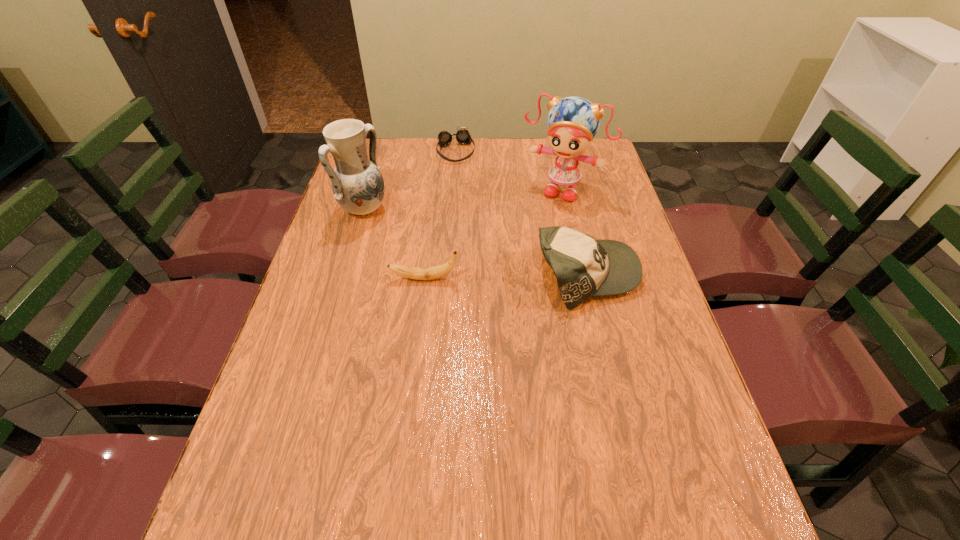
The width and height of the screenshot is (960, 540). What are the coordinates of `vacant space on the desktop that is between the second shortest object and the baseball cap and is positioned through the lenses of the farthest object` in the screenshot? It's located at (492, 277).

What are the coordinates of `free spot on the desktop that is between the banana and the baseball cap and is positioned on the face of the doll` in the screenshot? It's located at (x=516, y=276).

Where is `free space on the desktop that is between the banana and the baseball cap and is positioned on either side of the pottery`? free space on the desktop that is between the banana and the baseball cap and is positioned on either side of the pottery is located at coordinates (496, 277).